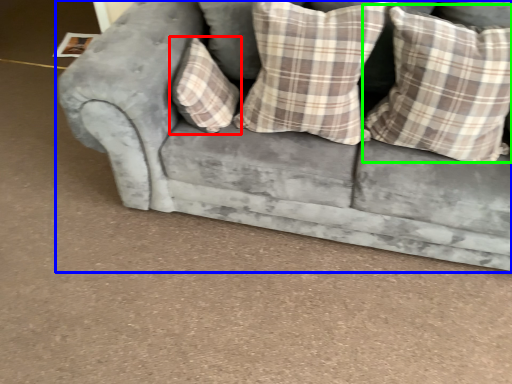
Question: Which is nearer to the pillow (highlighted by a red box)? studio couch (highlighted by a blue box) or pillow (highlighted by a green box).

Choices:
 (A) studio couch
 (B) pillow

Answer: (A)